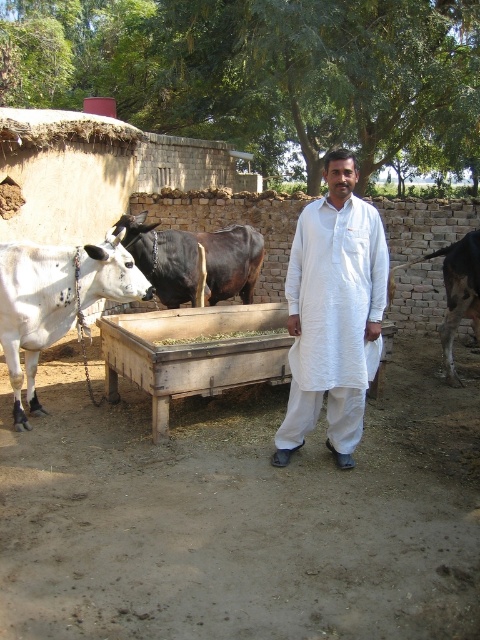
You are a photographer trying to capture the man in the white cotton kurta at center and the black glossy bull at right in the same frame. Based on their positions, which one would appear lower in the photo?

The white cotton kurta at center is located below the black glossy bull at right, so it would appear lower in the photo.

In the scene shown: You are a farmer who needs to identify the bigger bull to allocate more feed. You see a black glossy bull at center and a black glossy bull at right. Which bull should you give more feed to based on their size?

The black glossy bull at center is larger in size than the black glossy bull at right, so you should give more feed to the black glossy bull at center.